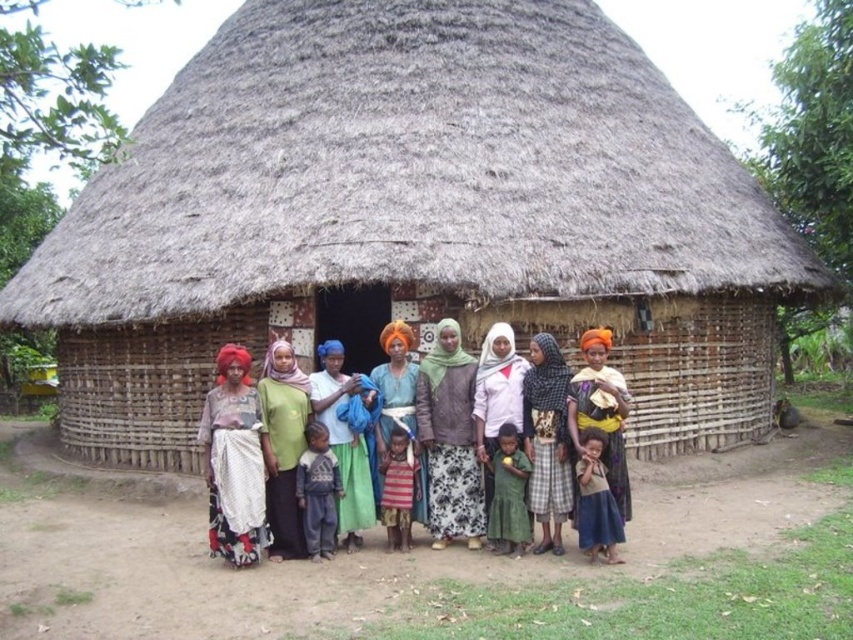
Which is above, checkered fabric dress at center or white cotton dress at center?

white cotton dress at center

Who is lower down, checkered fabric dress at center or white cotton dress at center?

checkered fabric dress at center is lower down.

The image size is (853, 640). What do you see at coordinates (547, 438) in the screenshot?
I see `checkered fabric dress at center` at bounding box center [547, 438].

Identify the location of checkered fabric dress at center. (547, 438).

Consider the image. Measure the distance from matte red headscarf at center to orange fabric headscarf at center.

A distance of 4.19 meters exists between matte red headscarf at center and orange fabric headscarf at center.

Who is more distant from viewer, (244, 563) or (578, 381)?

Positioned behind is point (578, 381).

Between point (252, 557) and point (575, 525), which one is positioned in front?

Point (252, 557) is more forward.

I want to click on matte red headscarf at center, so tap(234, 461).

Who is positioned more to the left, checkered fabric dress at center or green fabric dress at center?

Positioned to the left is green fabric dress at center.

Is point (556, 547) more distant than point (506, 460)?

That is False.

This screenshot has width=853, height=640. Describe the element at coordinates (547, 438) in the screenshot. I see `checkered fabric dress at center` at that location.

The image size is (853, 640). What are the coordinates of `checkered fabric dress at center` in the screenshot? It's located at (547, 438).